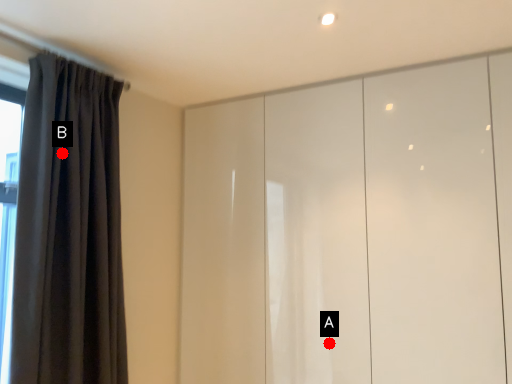
Question: Two points are circled on the image, labeled by A and B beside each circle. Which point is further to the camera?

Choices:
 (A) A is further
 (B) B is further

Answer: (A)